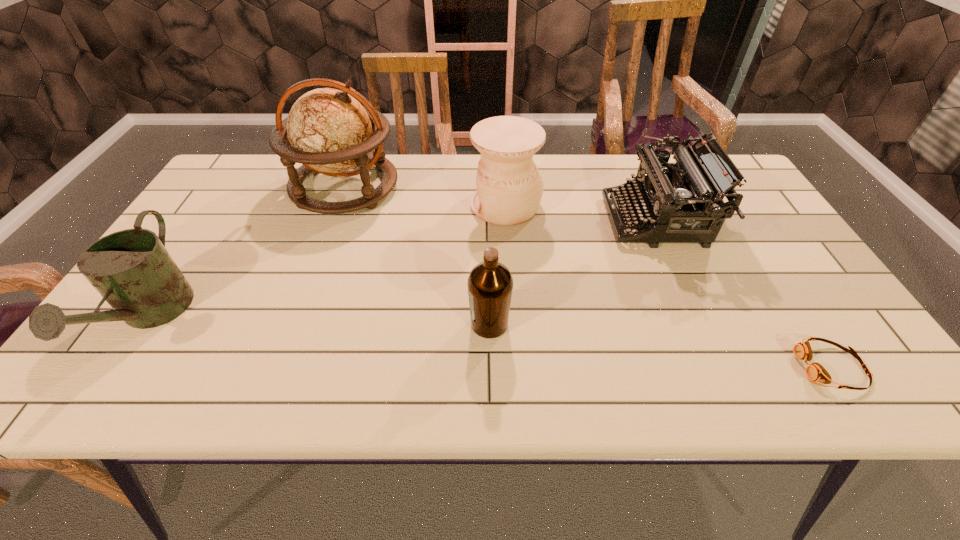
Image resolution: width=960 pixels, height=540 pixels. I want to click on free region at the far edge of the desktop, so click(423, 177).

Image resolution: width=960 pixels, height=540 pixels. In order to click on vacant space at the near edge of the desktop in this screenshot , I will do `click(542, 380)`.

In the image, there is a desktop. Where is `vacant area at the right edge`? Image resolution: width=960 pixels, height=540 pixels. vacant area at the right edge is located at coordinates (764, 275).

Where is `vacant space at the far left corner of the desktop`? The height and width of the screenshot is (540, 960). vacant space at the far left corner of the desktop is located at coordinates (263, 157).

This screenshot has height=540, width=960. Identify the location of free space between the watering can and the fifth object from left to right. (403, 269).

The height and width of the screenshot is (540, 960). What are the coordinates of `unoccupied position between the pottery and the second object from right to left` in the screenshot? It's located at (581, 213).

The width and height of the screenshot is (960, 540). Find the location of `free spot between the tallest object and the watering can`. free spot between the tallest object and the watering can is located at coordinates (248, 252).

Identify the location of unoccupied position between the pottery and the fifth object from left to right. (581, 213).

This screenshot has width=960, height=540. I want to click on unoccupied position between the leftmost object and the pottery, so click(x=328, y=261).

Image resolution: width=960 pixels, height=540 pixels. Find the location of `vacant area that lies between the goggles and the tallest object`. vacant area that lies between the goggles and the tallest object is located at coordinates (588, 277).